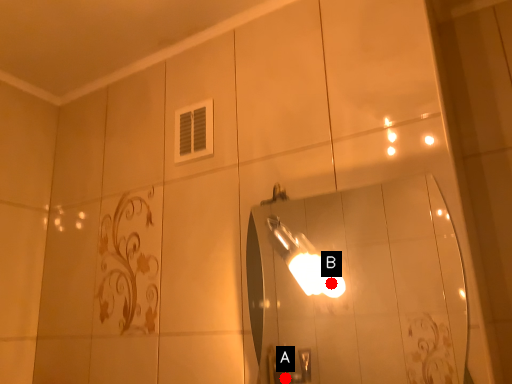
Question: Two points are circled on the image, labeled by A and B beside each circle. Which point appears farthest from the camera in this image?

Choices:
 (A) A is further
 (B) B is further

Answer: (A)